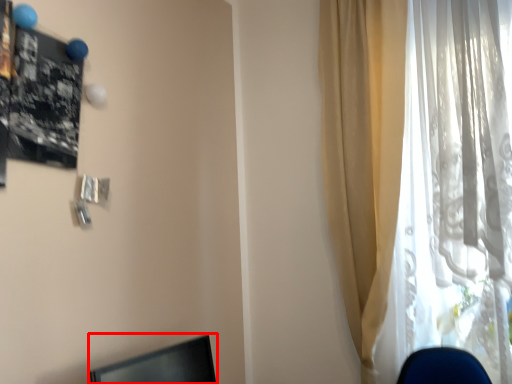
Question: Where is desktop (annotated by the red box) located in relation to curtain in the image?

Choices:
 (A) right
 (B) left

Answer: (B)